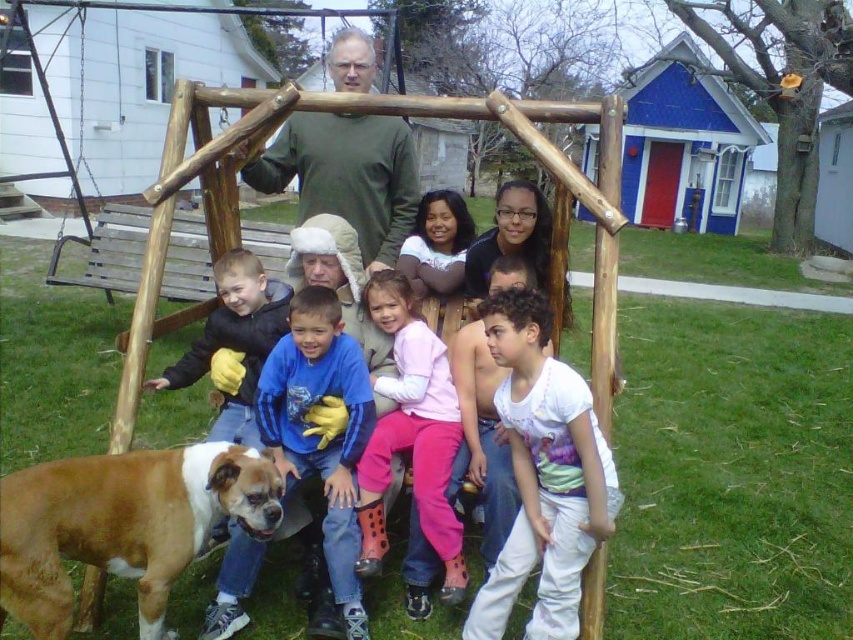
Question: Which point is closer to the camera taking this photo?

Choices:
 (A) (403, 225)
 (B) (358, 490)
 (C) (584, 404)
 (D) (9, 512)

Answer: (D)

Question: Is white cotton shirt at center thinner than wooden swing set at center?

Choices:
 (A) no
 (B) yes

Answer: (B)

Question: Does pink fleece pants at center appear under white fur dog at lower left?

Choices:
 (A) no
 (B) yes

Answer: (B)

Question: Is pink fleece pants at center above white fur dog at lower left?

Choices:
 (A) yes
 (B) no

Answer: (B)

Question: Which point is farther to the camera?

Choices:
 (A) (32, 636)
 (B) (584, 536)
 (C) (276, 291)

Answer: (C)

Question: Which point is farther to the camera?

Choices:
 (A) brown and white fur at lower left
 (B) green matte shirt at upper center

Answer: (B)